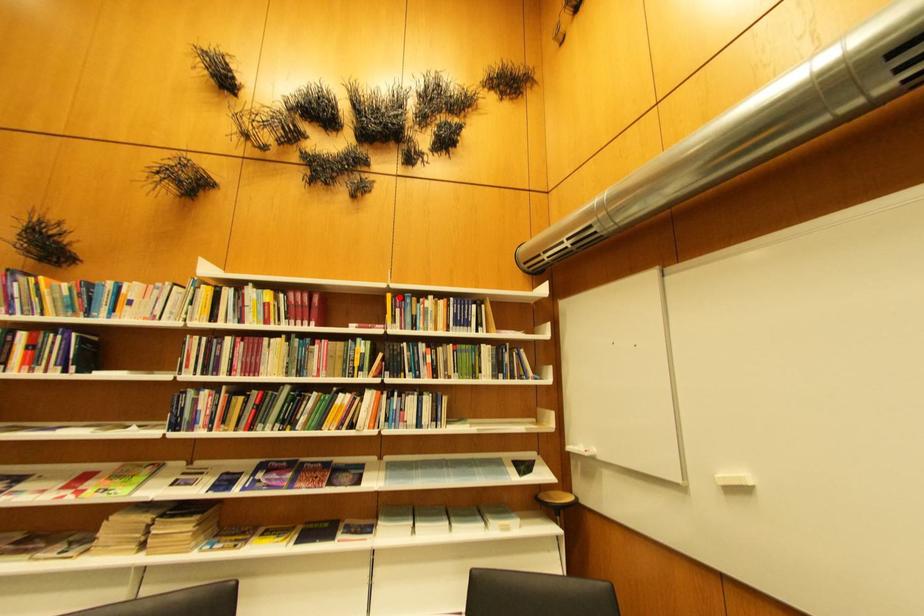
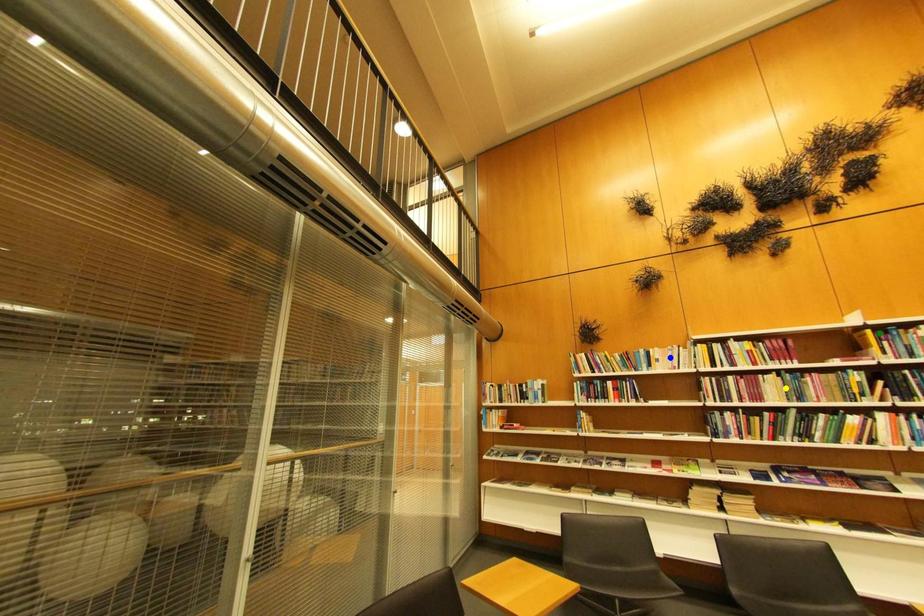
Question: I am providing you with two images of the same scene from different viewpoints. A red point is marked on the first image. You are given multiple points on the second image. In image 2, which mark is for the same physical point as the one in image 1?

Choices:
 (A) blue point
 (B) green point
 (C) yellow point

Answer: (B)